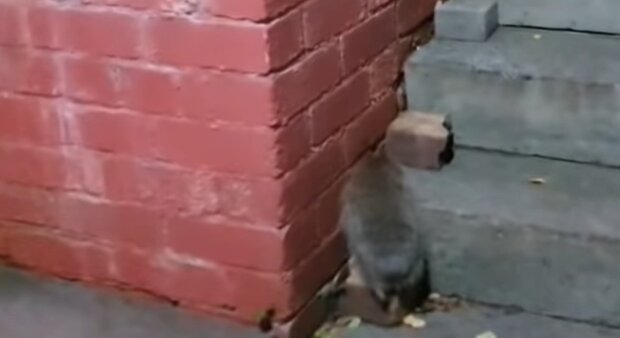
Where is `mouse`? Image resolution: width=620 pixels, height=338 pixels. mouse is located at coordinates (384, 219).